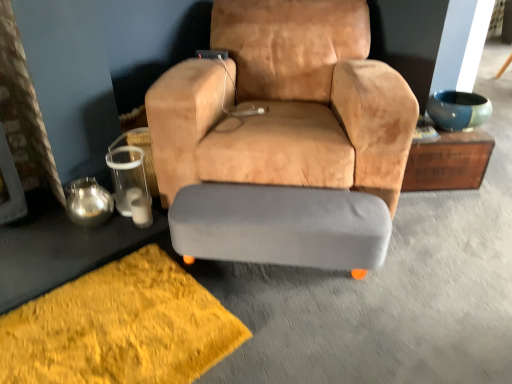
Identify the location of free space above metallic silver tray at lower left, which is the second table from top to bottom (from a real-world perspective). The width and height of the screenshot is (512, 384). (57, 239).